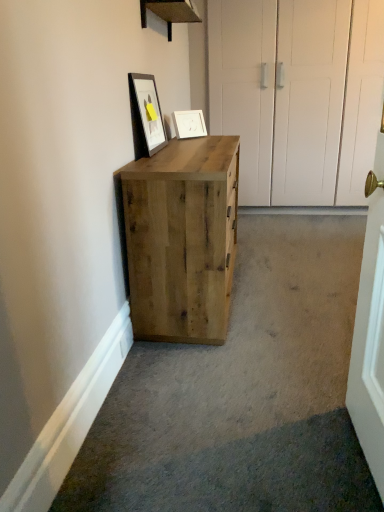
Question: Based on their sizes in the image, would you say natural wood cabinet at center is bigger or smaller than matte black picture frame at upper center, the second picture frame from the back?

Choices:
 (A) big
 (B) small

Answer: (A)

Question: Is natural wood cabinet at center wider or thinner than matte black picture frame at upper center, acting as the first picture frame starting from the front?

Choices:
 (A) wide
 (B) thin

Answer: (A)

Question: Which object is the closest to the white matte picture frame at upper center, the second picture frame viewed from the left?

Choices:
 (A) matte black picture frame at upper center, acting as the first picture frame starting from the front
 (B) natural wood cabinet at center

Answer: (A)

Question: Which object is the farthest from the matte black picture frame at upper center, the second picture frame from the back?

Choices:
 (A) white matte picture frame at upper center, the 1th picture frame positioned from the right
 (B) natural wood cabinet at center

Answer: (B)